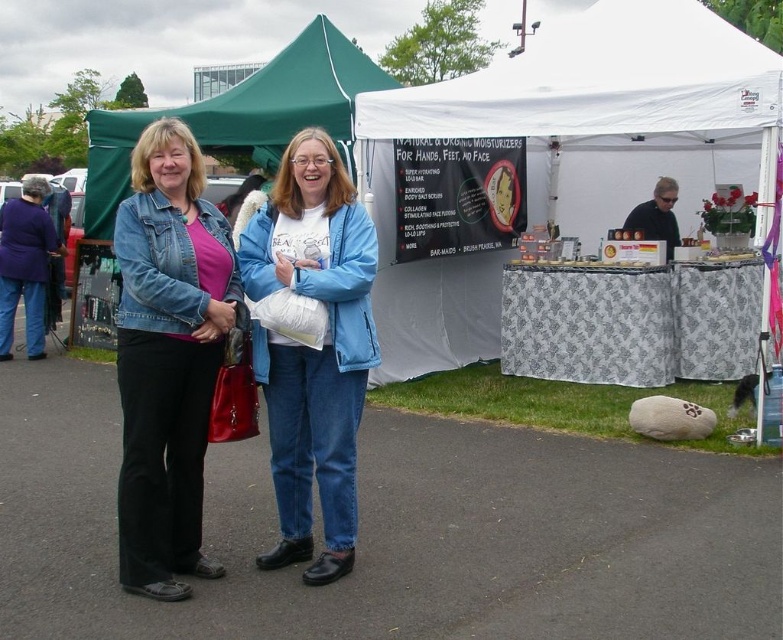
Question: Which point is closer to the camera?

Choices:
 (A) blue denim jacket at center
 (B) green fabric canopy at upper center
 (C) matte black shirt at upper center
 (D) denim jacket at left

Answer: (A)

Question: Among these objects, which one is nearest to the camera?

Choices:
 (A) denim jacket at left
 (B) blue denim jacket at center

Answer: (B)

Question: Which of the following is the farthest from the observer?

Choices:
 (A) (290, 236)
 (B) (659, 196)

Answer: (B)

Question: Can you confirm if blue denim jacket at center is positioned to the right of green fabric canopy at upper center?

Choices:
 (A) yes
 (B) no

Answer: (A)

Question: Is blue denim jacket at center further to camera compared to matte black shirt at upper center?

Choices:
 (A) yes
 (B) no

Answer: (B)

Question: Where is denim jacket at left located in relation to matte black shirt at upper center in the image?

Choices:
 (A) left
 (B) right

Answer: (A)